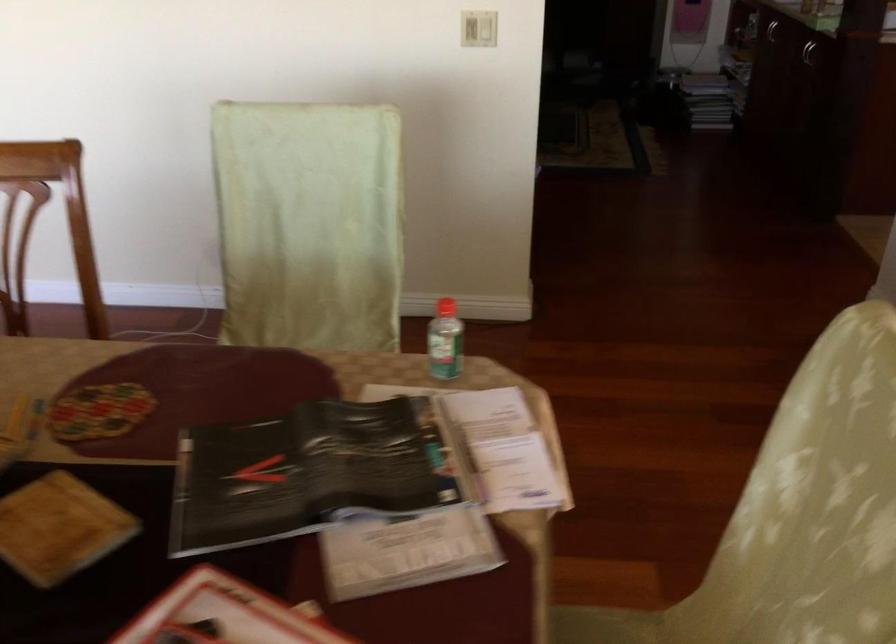
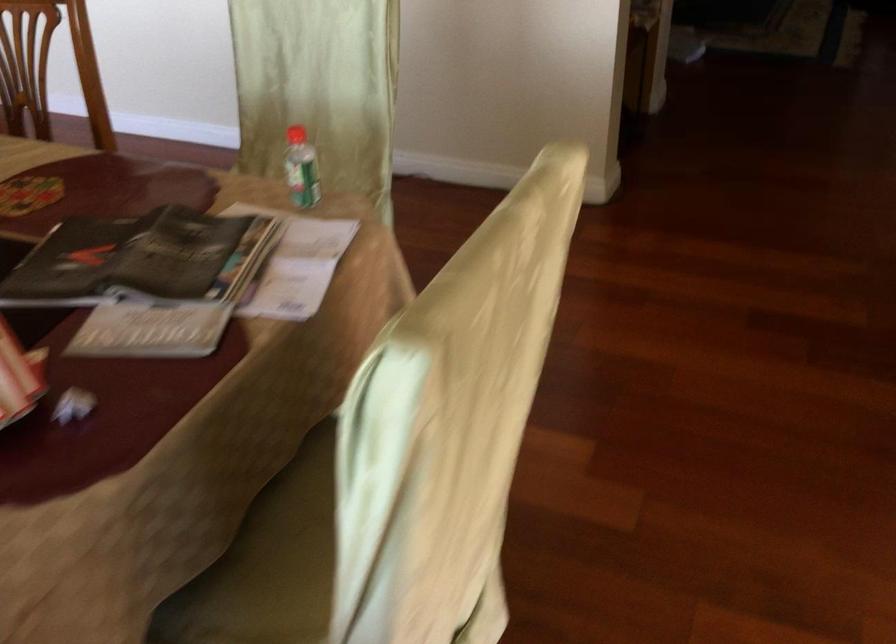
Question: The camera is either moving clockwise (left) or counter-clockwise (right) around the object. The first image is from the beginning of the video and the second image is from the end. Is the camera moving left or right when shooting the video?

Choices:
 (A) Left
 (B) Right

Answer: (B)